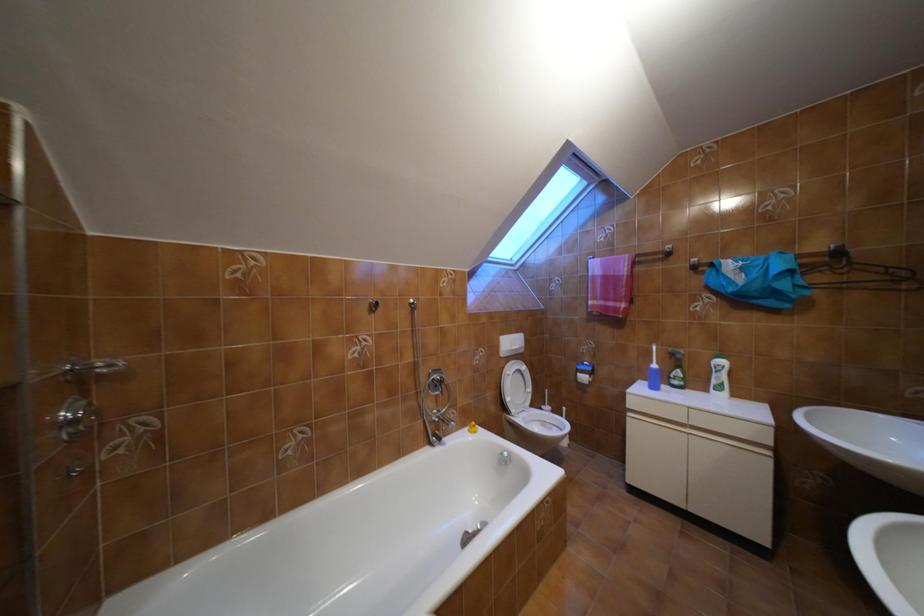
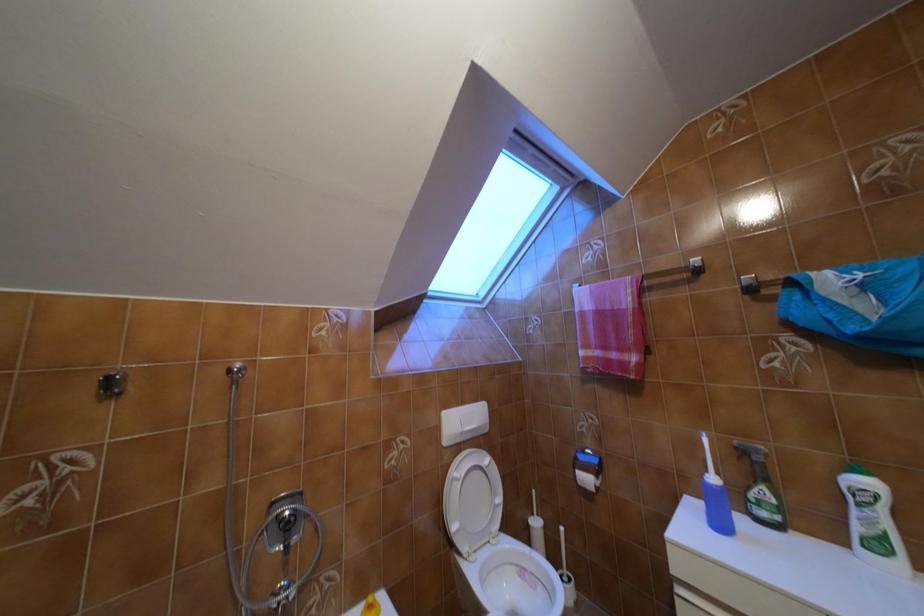
Which direction would the cameraman need to move to produce the second image?

The movement direction of the cameraman is right, forward.